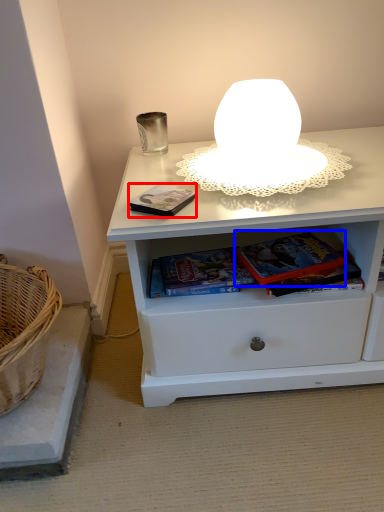
Question: Which object is further to the camera taking this photo, paperback book (highlighted by a red box) or paperback book (highlighted by a blue box)?

Choices:
 (A) paperback book
 (B) paperback book

Answer: (B)